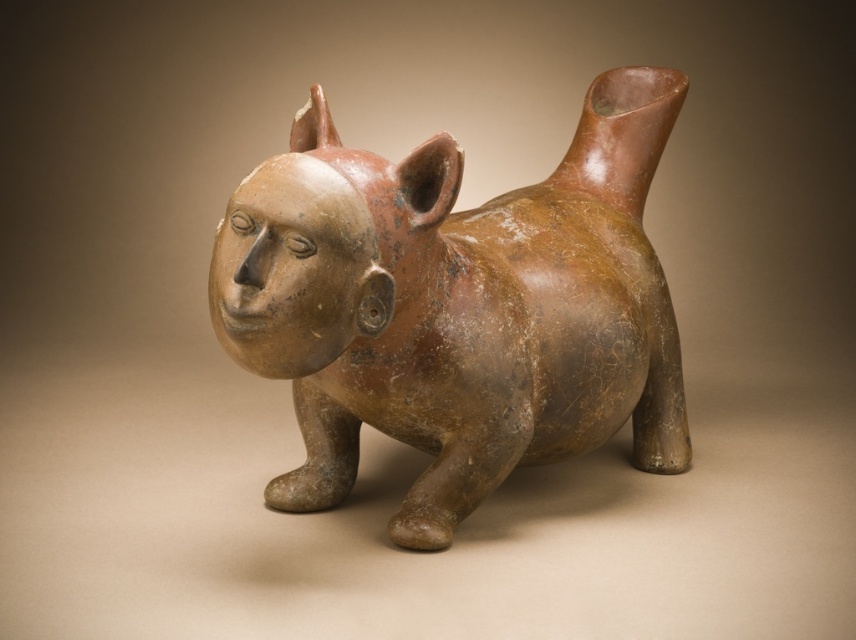
Which of these two, brown matte animal at center or matte clay head at center, stands shorter?

With less height is matte clay head at center.

Is brown matte animal at center to the right of matte clay head at center from the viewer's perspective?

Indeed, brown matte animal at center is positioned on the right side of matte clay head at center.

I want to click on brown matte animal at center, so click(456, 307).